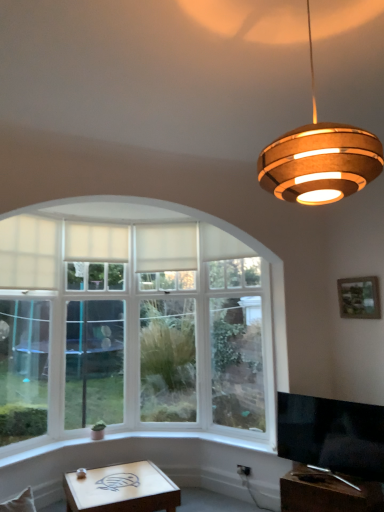
Question: Would you say matte white wooden table at lower center, the 2th table positioned from the right, is inside or outside white fabric curtain at upper left, which appears as the second curtain when viewed from the right?

Choices:
 (A) outside
 (B) inside

Answer: (A)

Question: Considering their positions, is matte white wooden table at lower center, positioned as the 1th table in left-to-right order, located in front of or behind white fabric curtain at upper left, which appears as the second curtain when viewed from the right?

Choices:
 (A) front
 (B) behind

Answer: (A)

Question: Based on their relative distances, which object is nearer to the clear glass door at center?

Choices:
 (A) wooden at lower right, the first table viewed from the right
 (B) black glossy tv at lower right
 (C) white fabric curtain at upper left, which appears as the second curtain when viewed from the right
 (D) wooden pendant light at upper right
 (E) wooden picture frame at upper right

Answer: (C)

Question: Estimate the real-world distances between objects in this image. Which object is farther from the white fabric curtain at center, which ranks as the 2th curtain in left-to-right order?

Choices:
 (A) white fabric curtain at upper left, which appears as the 1th curtain when viewed from the left
 (B) wooden at lower right, which is counted as the 2th table, starting from the left
 (C) wooden picture frame at upper right
 (D) black glossy tv at lower right
 (E) matte white wooden table at lower center, positioned as the 1th table in left-to-right order

Answer: (B)